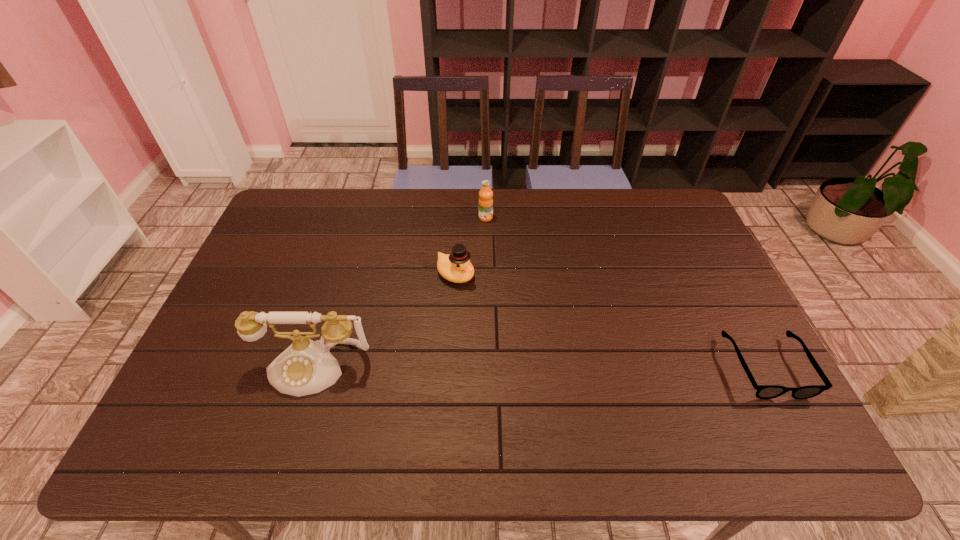
I want to click on vacant space located 0.260m on the label of the third shortest object, so click(524, 271).

Where is `vacant space located 0.310m on the front-facing side of the third nearest object`? The height and width of the screenshot is (540, 960). vacant space located 0.310m on the front-facing side of the third nearest object is located at coordinates (552, 342).

Where is `free space located on the front-facing side of the third nearest object`? This screenshot has width=960, height=540. free space located on the front-facing side of the third nearest object is located at coordinates (489, 298).

Find the location of a particular element. Image resolution: width=960 pixels, height=540 pixels. vacant region located 0.350m on the front-facing side of the third nearest object is located at coordinates (564, 350).

Identify the location of object that is at the far edge. The image size is (960, 540). (485, 201).

This screenshot has height=540, width=960. In order to click on telephone positioned at the near edge in this screenshot , I will do `click(306, 367)`.

Find the location of a particular element. spectacles present at the near edge is located at coordinates pos(763,391).

I want to click on object positioned at the left edge, so click(x=306, y=367).

You are a GUI agent. You are given a task and a screenshot of the screen. Output one action in this format:
    pyautogui.click(x=<x>, y=<y>)
    Task: Click on the object located in the right edge section of the desktop
    The width and height of the screenshot is (960, 540).
    Given the screenshot: What is the action you would take?
    pyautogui.click(x=763, y=391)

This screenshot has width=960, height=540. Identify the location of object located in the near left corner section of the desktop. (306, 367).